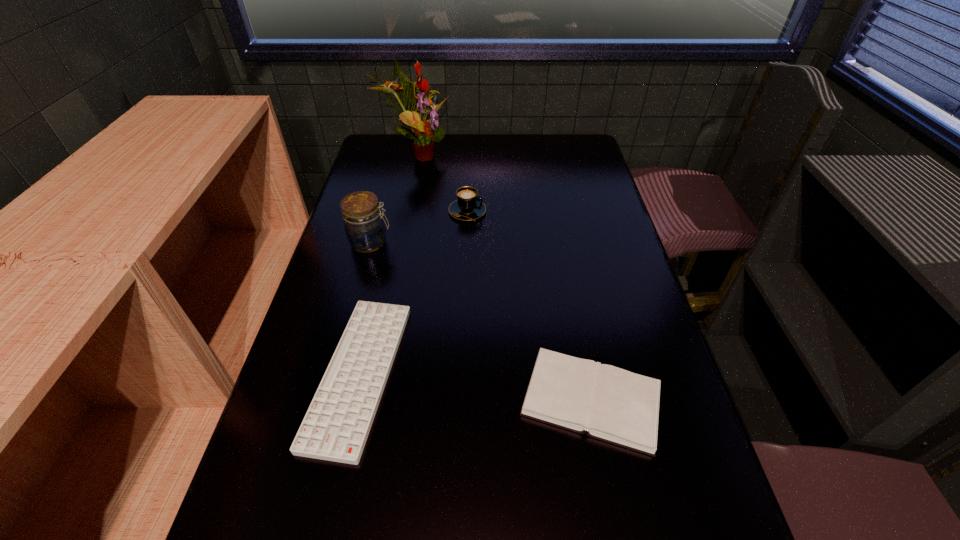
This screenshot has width=960, height=540. What are the coordinates of `free space at the left edge of the desktop` in the screenshot? It's located at pos(306,462).

The height and width of the screenshot is (540, 960). In the image, there is a desktop. In order to click on vacant space at the right edge in this screenshot , I will do `click(677, 536)`.

I want to click on free region at the far left corner of the desktop, so click(384, 143).

Find the location of a particular element. free space between the fourth object from left to right and the farthest object is located at coordinates (442, 183).

Where is `vacant area between the rightmost object and the shortest object`? The image size is (960, 540). vacant area between the rightmost object and the shortest object is located at coordinates [x=475, y=387].

You are a GUI agent. You are given a task and a screenshot of the screen. Output one action in this format:
    pyautogui.click(x=<x>, y=<y>)
    Task: Click on the vacant area that lies between the second farthest object and the jar
    
    Given the screenshot: What is the action you would take?
    tap(419, 227)

The image size is (960, 540). Identify the location of free space between the third tallest object and the farthest object. (442, 183).

Where is `free spot between the fourth shortest object and the tallest object`? This screenshot has height=540, width=960. free spot between the fourth shortest object and the tallest object is located at coordinates (393, 199).

At what (x,y) coordinates should I click in order to perform the action: click on unoccupied position between the farthest object and the hardback book. Please return your answer as a coordinate pair (x, y). This screenshot has height=540, width=960. Looking at the image, I should click on (503, 277).

Where is `object that stands as the third closest to the fourth nearest object`? The width and height of the screenshot is (960, 540). object that stands as the third closest to the fourth nearest object is located at coordinates (336, 426).